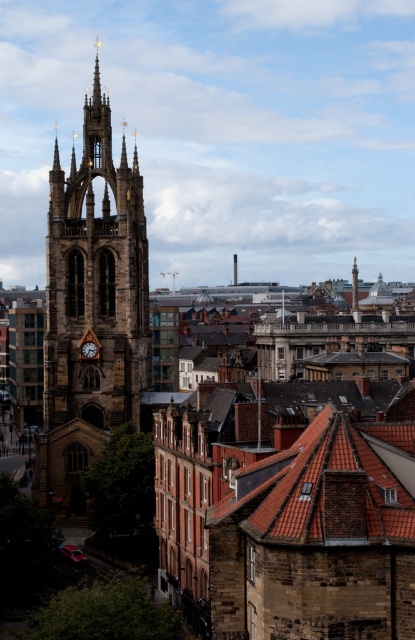
Question: In this image, where is dark brown stone tower at center-left located relative to matte brown clock at center-left?

Choices:
 (A) left
 (B) right

Answer: (A)

Question: Does dark brown stone tower at center-left have a larger size compared to matte brown clock at center-left?

Choices:
 (A) no
 (B) yes

Answer: (B)

Question: Does dark brown stone tower at center-left appear over matte brown clock at center-left?

Choices:
 (A) no
 (B) yes

Answer: (B)

Question: Which point is farther to the camera?

Choices:
 (A) (92, 280)
 (B) (83, 352)

Answer: (A)

Question: Which point is closer to the camera?

Choices:
 (A) (87, 355)
 (B) (97, 161)

Answer: (A)